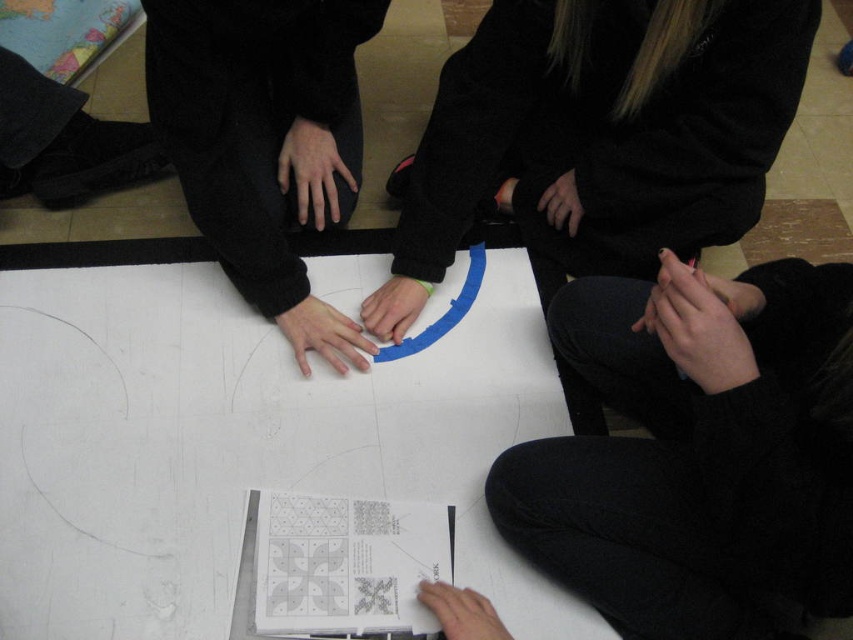
Question: Which point is closer to the camera?

Choices:
 (A) (543, 196)
 (B) (399, 285)
 (C) (239, 467)
 (D) (459, 625)

Answer: (D)

Question: Among these points, which one is farthest from the camera?

Choices:
 (A) (735, 291)
 (B) (387, 294)
 (C) (161, 305)

Answer: (C)

Question: Is smooth white paper at lower center bigger than black matte hand at center?

Choices:
 (A) no
 (B) yes

Answer: (A)

Question: Can you confirm if smooth white paper at lower center is bigger than matte blue circle at center?

Choices:
 (A) no
 (B) yes

Answer: (A)

Question: Which object is the closest to the smooth skin hands at lower right?

Choices:
 (A) smooth white paper at lower center
 (B) black fleece at center
 (C) white paper at center
 (D) black matte hand at center

Answer: (B)

Question: Can you confirm if smooth skin hands at lower right is positioned to the right of smooth white paper at lower center?

Choices:
 (A) no
 (B) yes

Answer: (B)